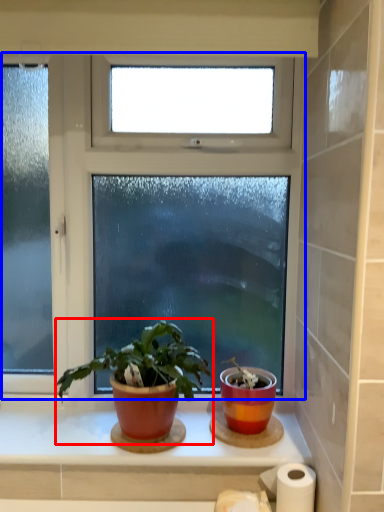
Question: Which of the following is the closest to the observer, houseplant (highlighted by a red box) or window (highlighted by a blue box)?

Choices:
 (A) houseplant
 (B) window

Answer: (A)